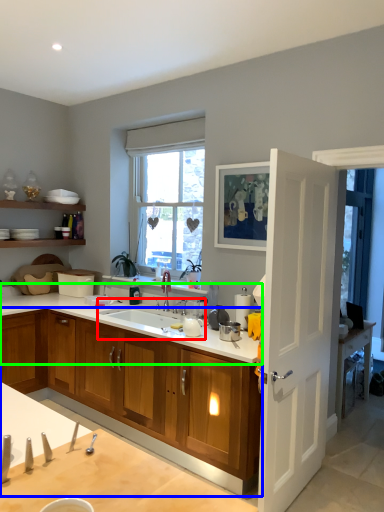
Question: Which object is positioned farthest from sink (highlighted by a red box)? Select from cabinetry (highlighted by a blue box) and countertop (highlighted by a green box).

Choices:
 (A) cabinetry
 (B) countertop

Answer: (A)